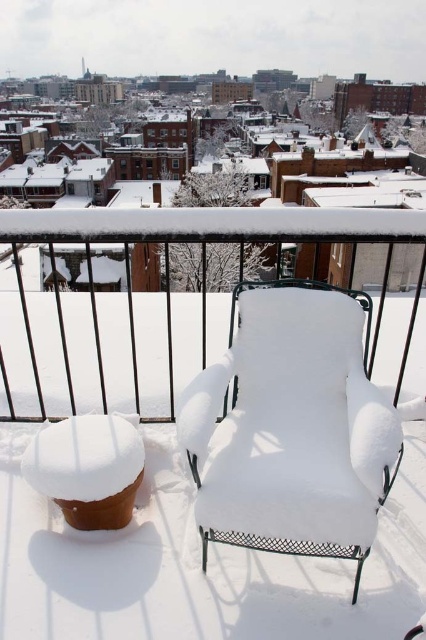
Question: Which point is closer to the camera?

Choices:
 (A) white fabric chair at center
 (B) white snow-covered chair at center

Answer: (A)

Question: Which object is farther from the camera taking this photo?

Choices:
 (A) white snow-covered chair at center
 (B) white fabric chair at center

Answer: (A)

Question: Where is white snow-covered chair at center located in relation to white fabric chair at center in the image?

Choices:
 (A) below
 (B) above

Answer: (B)

Question: Can you confirm if white snow-covered chair at center is thinner than white fabric chair at center?

Choices:
 (A) no
 (B) yes

Answer: (A)

Question: Among these points, which one is nearest to the camera?

Choices:
 (A) (368, 349)
 (B) (201, 410)

Answer: (B)

Question: Is white snow-covered chair at center to the right of white fabric chair at center from the viewer's perspective?

Choices:
 (A) yes
 (B) no

Answer: (B)